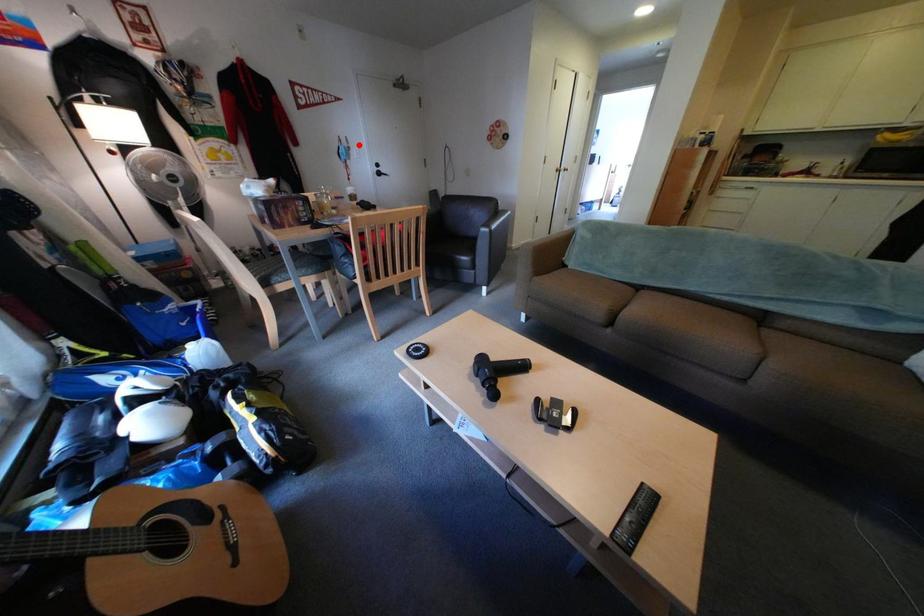
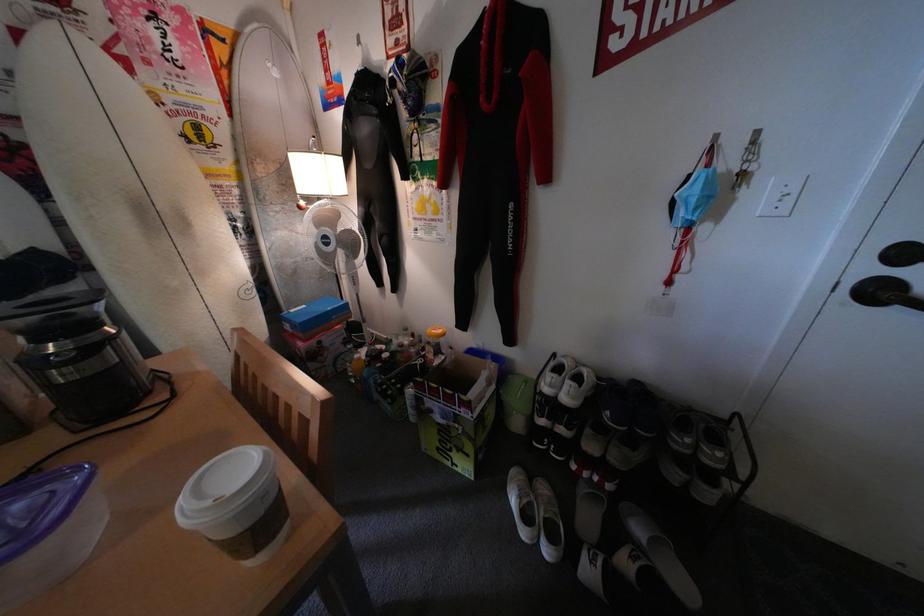
Where in the second image is the point corresponding to the highlighted location from the first image?

(744, 161)